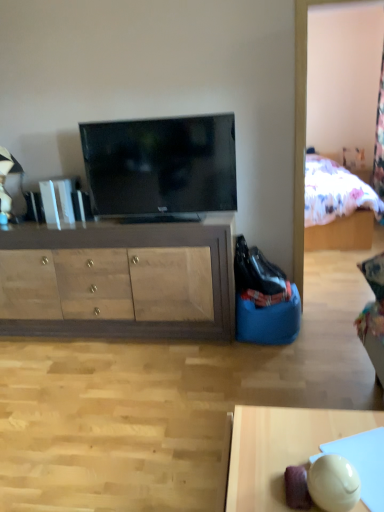
What is the approximate height of wooden cabinet at center?

wooden cabinet at center is 81.66 centimeters tall.

The height and width of the screenshot is (512, 384). In order to click on wooden cabinet at center in this screenshot , I will do `click(123, 281)`.

The height and width of the screenshot is (512, 384). In order to click on smooth wooden desk at lower right in this screenshot , I will do `click(281, 449)`.

What are the coordinates of `wooden cabinet at center` in the screenshot? It's located at (123, 281).

The image size is (384, 512). Identify the location of television in front of the wooden cabinet at center. (161, 166).

From a real-world perspective, who is located higher, matte black tv at center or wooden cabinet at center?

From a 3D spatial view, matte black tv at center is above.

Which object is wider, matte black tv at center or wooden cabinet at center?

wooden cabinet at center is wider.

From the image's perspective, would you say matte black tv at center is shown under wooden cabinet at center?

No, from the image's perspective, matte black tv at center is not below wooden cabinet at center.

From a real-world perspective, is wooden cabinet at center under matte black tv at center?

Yes, from a real-world perspective, wooden cabinet at center is beneath matte black tv at center.

How many degrees apart are the facing directions of wooden cabinet at center and matte black tv at center?

There is a 0.62-degree angle between the facing directions of wooden cabinet at center and matte black tv at center.

Where is `cabinetry that appears below the matte black tv at center (from the image's perspective)`? cabinetry that appears below the matte black tv at center (from the image's perspective) is located at coordinates (123, 281).

Looking at this image, does wooden cabinet at center turn towards matte black tv at center?

No, wooden cabinet at center is not aimed at matte black tv at center.

Can we say smooth wooden desk at lower right lies outside matte black tv at center?

smooth wooden desk at lower right is positioned outside matte black tv at center.

Considering the relative sizes of smooth wooden desk at lower right and matte black tv at center in the image provided, is smooth wooden desk at lower right smaller than matte black tv at center?

No, smooth wooden desk at lower right is not smaller than matte black tv at center.

Could you tell me if smooth wooden desk at lower right is facing matte black tv at center?

No, smooth wooden desk at lower right does not turn towards matte black tv at center.

From the image's perspective, is smooth wooden desk at lower right below matte black tv at center?

Correct, smooth wooden desk at lower right appears lower than matte black tv at center in the image.

Is matte black tv at center positioned with its back to smooth wooden desk at lower right?

No, matte black tv at center's orientation is not away from smooth wooden desk at lower right.

Is matte black tv at center thinner than smooth wooden desk at lower right?

Yes.

Which object is closer to the camera taking this photo, matte black tv at center or smooth wooden desk at lower right?

smooth wooden desk at lower right is in front.

From the image's perspective, is smooth wooden desk at lower right below wooden cabinet at center?

Yes.

Is wooden cabinet at center inside smooth wooden desk at lower right?

Definitely not — wooden cabinet at center is not inside smooth wooden desk at lower right.

How much distance is there between smooth wooden desk at lower right and wooden cabinet at center?

The distance of smooth wooden desk at lower right from wooden cabinet at center is 4.98 feet.

Which of these two, smooth wooden desk at lower right or wooden cabinet at center, is thinner?

smooth wooden desk at lower right is thinner.

Which of these two, wooden cabinet at center or smooth wooden desk at lower right, is bigger?

Bigger between the two is wooden cabinet at center.

Locate an element on the screen. cabinetry on the left of the smooth wooden desk at lower right is located at coordinates (123, 281).

From their relative heights in the image, would you say wooden cabinet at center is taller or shorter than smooth wooden desk at lower right?

In the image, wooden cabinet at center appears to be taller than smooth wooden desk at lower right.

Identify the location of television in front of the wooden cabinet at center. (161, 166).

Where is `cabinetry beneath the matte black tv at center (from a real-world perspective)`? cabinetry beneath the matte black tv at center (from a real-world perspective) is located at coordinates (123, 281).

Looking at this image, from the image, which object appears to be farther from wooden cabinet at center, smooth wooden desk at lower right or matte black tv at center?

Based on the image, smooth wooden desk at lower right appears to be further to wooden cabinet at center.

Considering their positions, is smooth wooden desk at lower right positioned closer to matte black tv at center than wooden cabinet at center?

Based on the image, wooden cabinet at center appears to be nearer to matte black tv at center.

Based on their spatial positions, is matte black tv at center or wooden cabinet at center closer to smooth wooden desk at lower right?

wooden cabinet at center lies closer to smooth wooden desk at lower right than the other object.

Based on their spatial positions, is wooden cabinet at center or smooth wooden desk at lower right closer to matte black tv at center?

Among the two, wooden cabinet at center is located nearer to matte black tv at center.

Considering their positions, is matte black tv at center positioned further to wooden cabinet at center than smooth wooden desk at lower right?

smooth wooden desk at lower right.

Based on their spatial positions, is wooden cabinet at center or matte black tv at center further from smooth wooden desk at lower right?

matte black tv at center is further to smooth wooden desk at lower right.

The width and height of the screenshot is (384, 512). I want to click on television positioned between smooth wooden desk at lower right and wooden cabinet at center from near to far, so click(x=161, y=166).